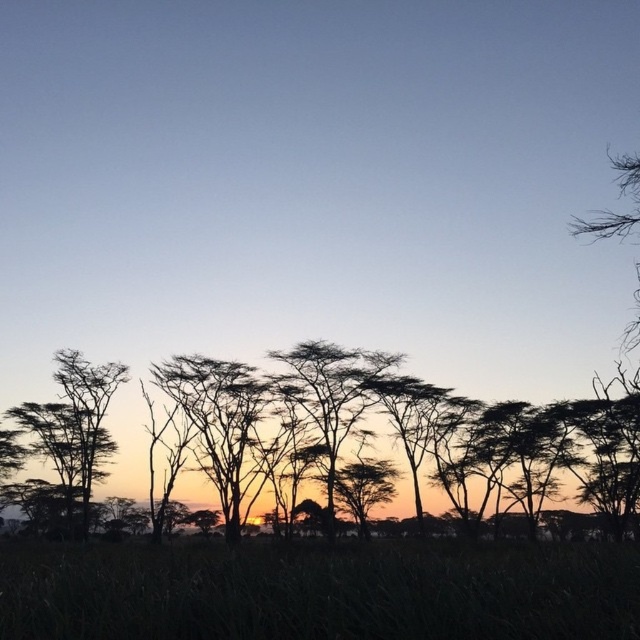
You are an astronomer observing the sky in this landscape. You notice two points of light in the sky at coordinates point [515,552] and point [589,492]. Which point is closer to your eyes?

Point [515,552] is closer to the viewer than point [589,492].

You are a park ranger planning to install a solar panel that requires direct sunlight. You have a solar panel that is 2 meters wide. The solar panel needs to be placed between the green grass at lower center and the silhouette tree at center. Will the space between them be wide enough to accommodate the solar panel?

The distance between the green grass at lower center and the silhouette tree at center is 20.26 meters, which is more than enough to accommodate a 2 meter wide solar panel.